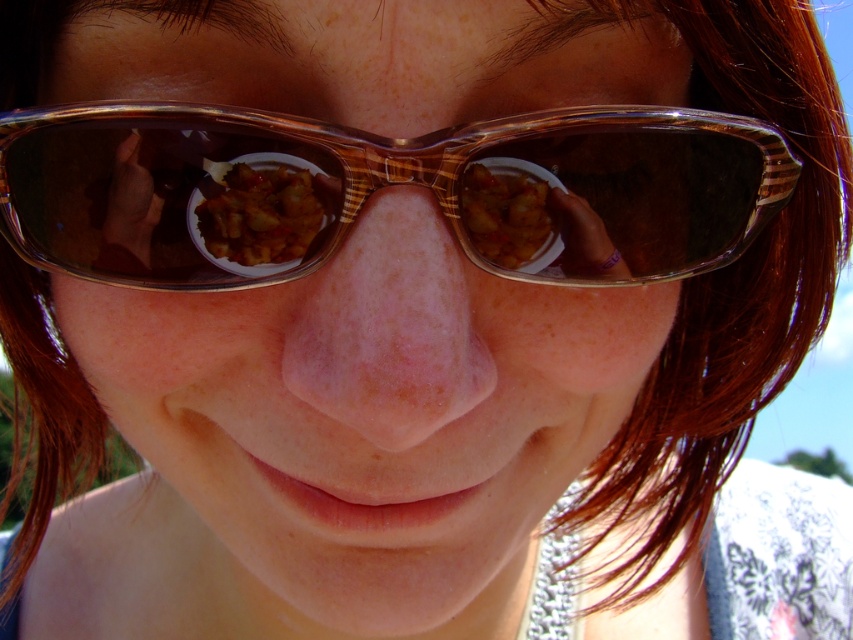
You are a food critic who needs to describe the dish in the reflection of the sunglasses. Which object from the scene is bigger, the matte brown bowl at center or the golden fried chicken at nose?

The matte brown bowl at center is larger in size than the golden fried chicken at nose, so the matte brown bowl at center is bigger.

Consider the image. You are a photographer trying to capture the translucent brown goggles at center and the matte brown bowl at center in a single frame. Given their sizes, which object will appear bigger in your photo?

The translucent brown goggles at center will appear bigger in the photo since they are larger in size compared to the matte brown bowl at center.